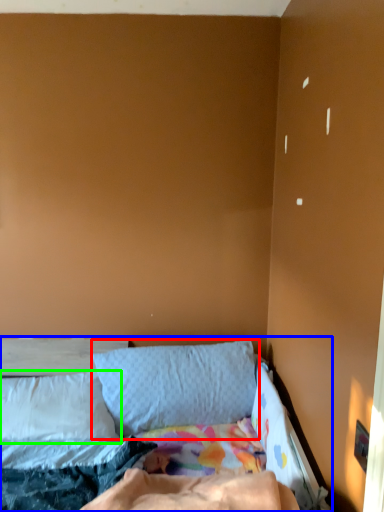
Question: Which object is positioned farthest from pillow (highlighted by a red box)? Select from bed (highlighted by a blue box) and pillow (highlighted by a green box).

Choices:
 (A) bed
 (B) pillow

Answer: (A)